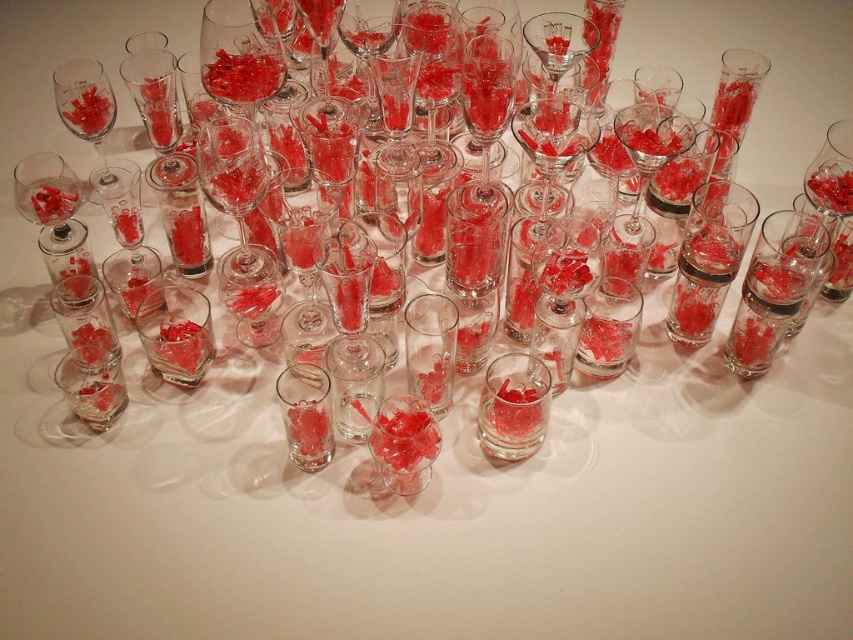
You are setting up a table for a party and need to place a decorative item between the transparent glass at right and the transparent glass at center. Based on their positions, where should you place the item?

The transparent glass at right is to the right of the transparent glass at center, so you should place the decorative item between them by positioning it to the right of the transparent glass at center and to the left of the transparent glass at right.